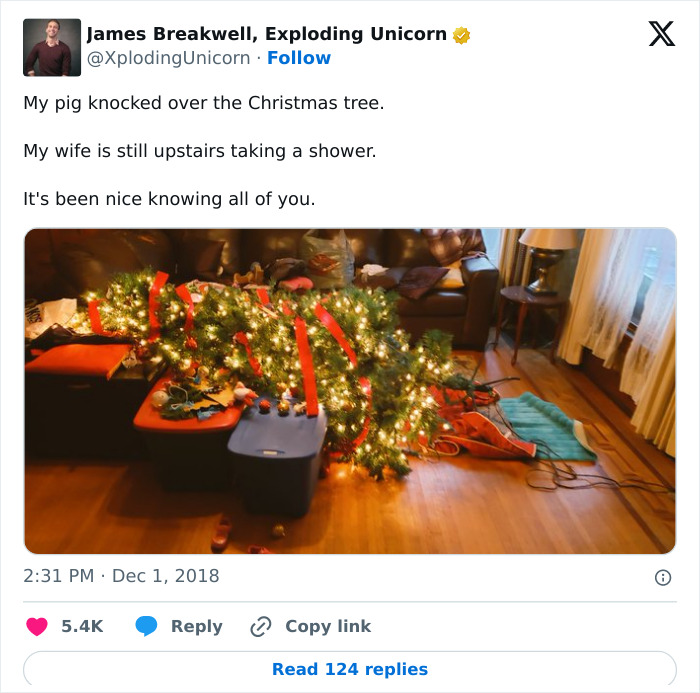
Identify the location of lamp. (547, 254).